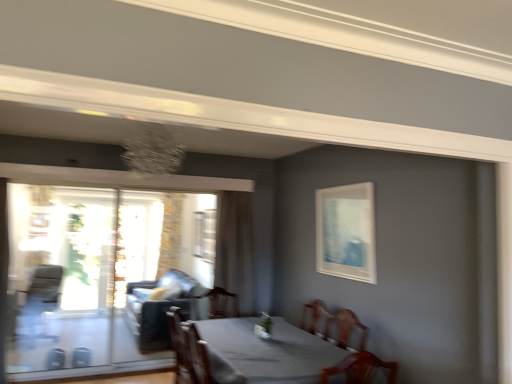
The width and height of the screenshot is (512, 384). Find the location of `free spot above matte white picture frame at upper right (from a real-world perspective)`. free spot above matte white picture frame at upper right (from a real-world perspective) is located at coordinates (345, 180).